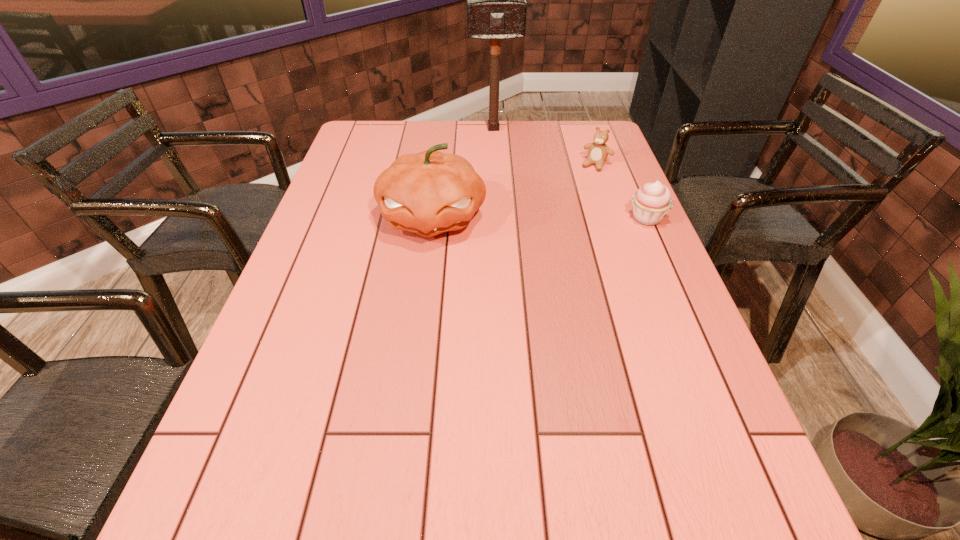
At what (x,y) coordinates should I click in order to perform the action: click on vacant space located 0.120m on the front-facing side of the third nearest object. Please return your answer as a coordinate pair (x, y). Looking at the image, I should click on (579, 191).

Find the location of a particular element. free space located 0.380m on the front-facing side of the third nearest object is located at coordinates (545, 239).

Locate an element on the screen. blank space located on the front-facing side of the third nearest object is located at coordinates (561, 217).

This screenshot has width=960, height=540. I want to click on object that is at the far edge, so click(x=496, y=0).

Image resolution: width=960 pixels, height=540 pixels. I want to click on cupcake that is at the right edge, so click(652, 202).

Where is `teddy bear that is at the right edge`? teddy bear that is at the right edge is located at coordinates (598, 152).

This screenshot has height=540, width=960. In order to click on free region at the far edge in this screenshot , I will do `click(547, 144)`.

In the image, there is a desktop. Identify the location of vacant area at the near edge. (355, 429).

Where is `vacant space at the left edge of the desktop`? This screenshot has height=540, width=960. vacant space at the left edge of the desktop is located at coordinates (344, 178).

Image resolution: width=960 pixels, height=540 pixels. I want to click on vacant space at the right edge, so click(639, 246).